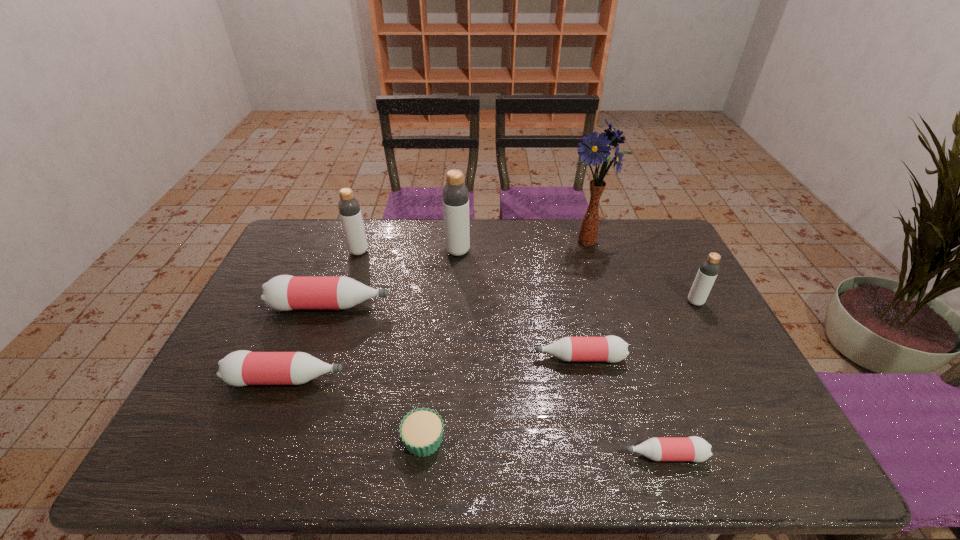
This screenshot has height=540, width=960. I want to click on purple flower arrangement, so click(x=594, y=149).

Where is `flower arrangement`? Image resolution: width=960 pixels, height=540 pixels. flower arrangement is located at coordinates (594, 149).

At what (x,y) coordinates should I click in order to perform the action: click on the tallest bottle. Please return your answer as a coordinate pair (x, y). Looking at the image, I should click on (455, 195).

Image resolution: width=960 pixels, height=540 pixels. Identify the location of the second tallest object. (455, 195).

Identify the location of the second tallest bottle. (349, 209).

Find the location of a particular element. the second biggest gray bottle is located at coordinates (349, 209).

Where is `the rightmost gray bottle`? The width and height of the screenshot is (960, 540). the rightmost gray bottle is located at coordinates (709, 268).

Identify the location of the fifth shortest bottle. (709, 268).

Where is `the biggest pink bottle`? Image resolution: width=960 pixels, height=540 pixels. the biggest pink bottle is located at coordinates (284, 292).

The image size is (960, 540). I want to click on the farthest pink bottle, so click(284, 292).